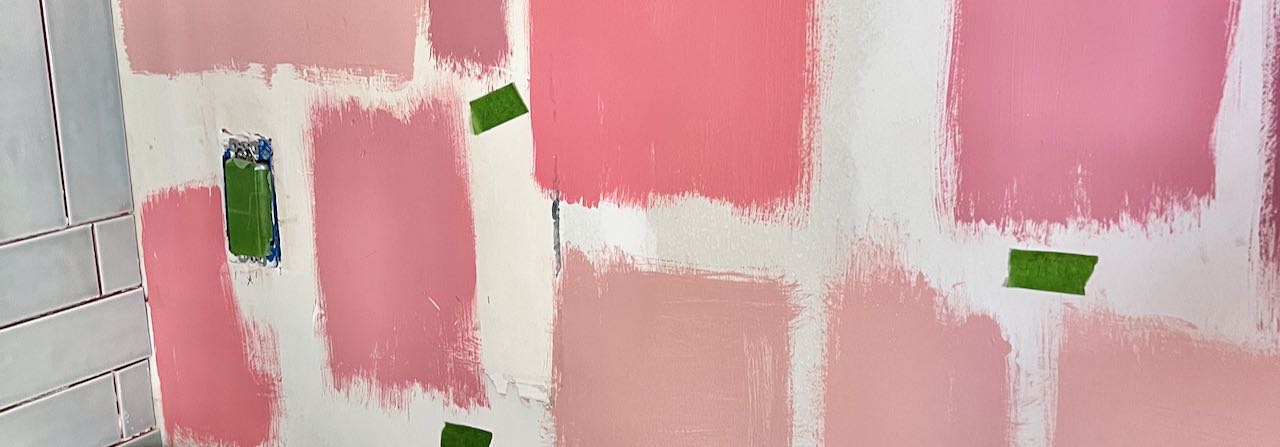
Locate an element on the screen. tile wall is located at coordinates (42, 202).